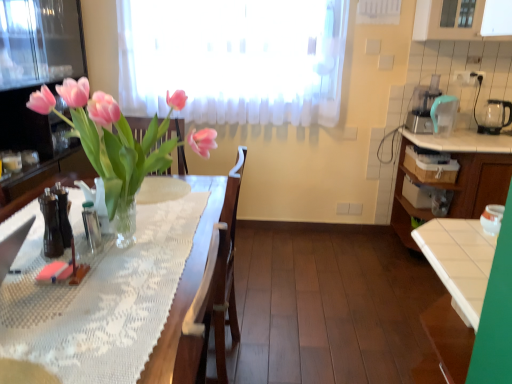
Where is `vacant region below transparent glass kettle at right, the 1th appliance positioned from the top (from a real-world perspective)`? The width and height of the screenshot is (512, 384). vacant region below transparent glass kettle at right, the 1th appliance positioned from the top (from a real-world perspective) is located at coordinates (492, 131).